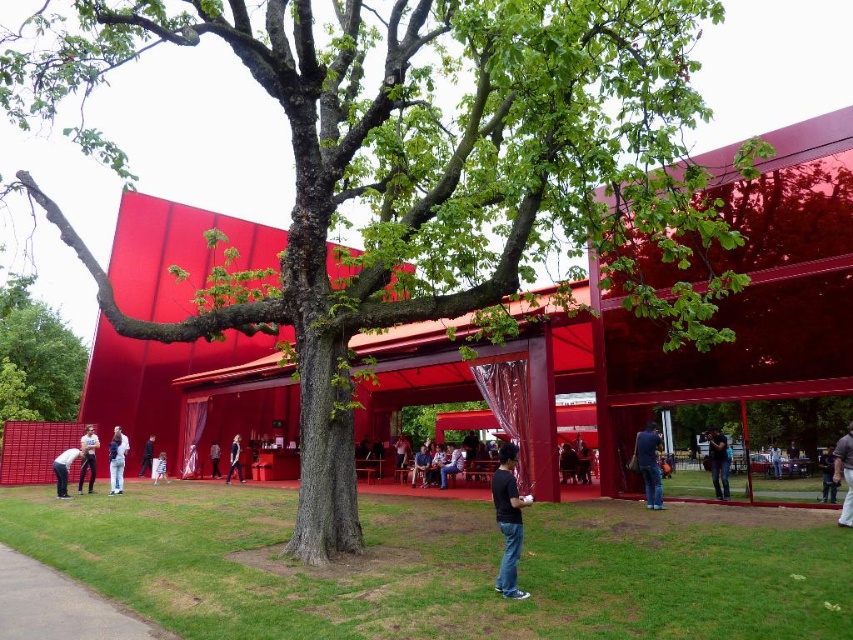
Between green leafy tree at center and dark gray fabric at lower right, which one has more height?

Standing taller between the two is dark gray fabric at lower right.

This screenshot has width=853, height=640. What do you see at coordinates (798, 420) in the screenshot? I see `green leafy tree at center` at bounding box center [798, 420].

Find the location of `green leafy tree at center`. green leafy tree at center is located at coordinates (798, 420).

Does point (773, 467) come in front of point (213, 442)?

Yes, it is.

Is jeans at center behind white cotton shirt at center?

No, jeans at center is in front of white cotton shirt at center.

Which is in front, point (780, 461) or point (218, 461)?

Point (780, 461) is more forward.

At what (x,y) coordinates should I click in order to perform the action: click on jeans at center. Please return your answer as a coordinate pair (x, y). Looking at the image, I should click on (775, 460).

Is white cotton shirt at lower left wider than dark blue jeans at lower left?

Incorrect, white cotton shirt at lower left's width does not surpass dark blue jeans at lower left's.

Is white cotton shirt at lower left shorter than dark blue jeans at lower left?

No.

Who is more distant from viewer, (115, 433) or (55, 474)?

The point (115, 433) is more distant.

Where is `white cotton shirt at lower left`? The height and width of the screenshot is (640, 853). white cotton shirt at lower left is located at coordinates (117, 460).